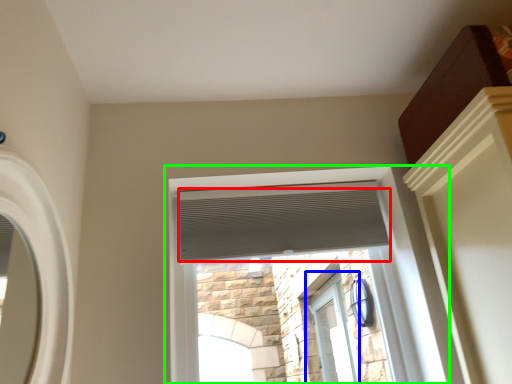
Question: Which is farther away from blind (highlighted by a red box)? window (highlighted by a blue box) or window (highlighted by a green box)?

Choices:
 (A) window
 (B) window

Answer: (A)